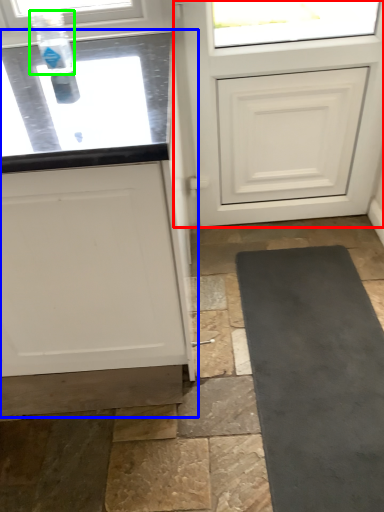
Question: Which object is the farthest from door (highlighted by a red box)? Choose among these: cabinetry (highlighted by a blue box) or bottle (highlighted by a green box).

Choices:
 (A) cabinetry
 (B) bottle

Answer: (B)